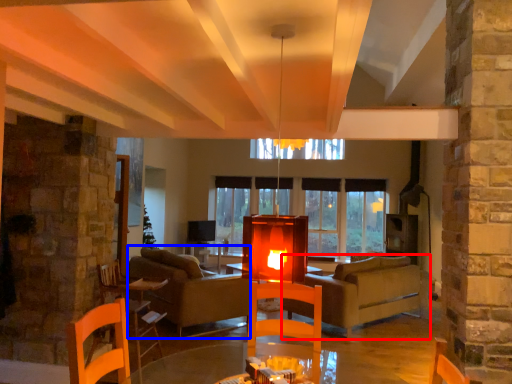
Question: Among these objects, which one is nearest to the camera, studio couch (highlighted by a red box) or couch (highlighted by a blue box)?

Choices:
 (A) studio couch
 (B) couch

Answer: (B)